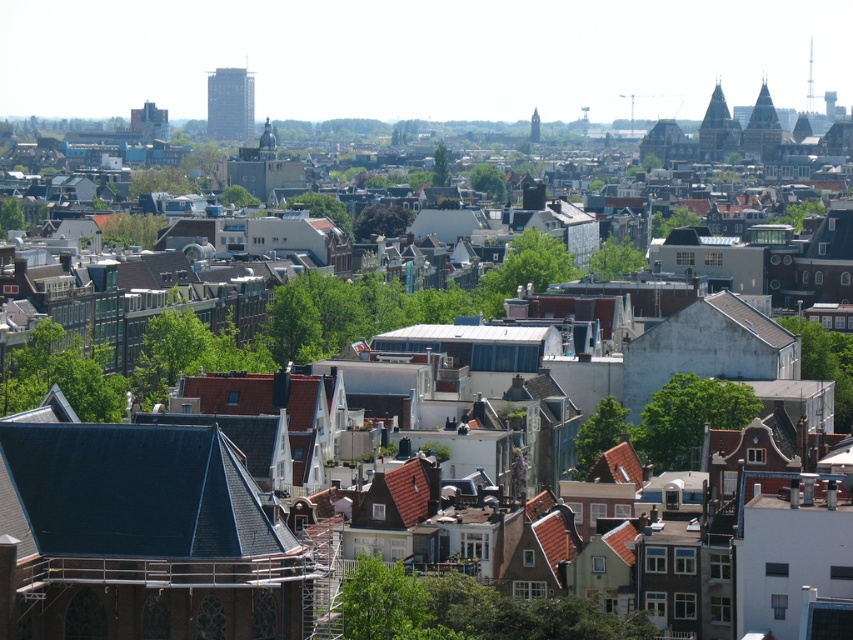
You are standing in the urban area shown in the image and want to walk from the point at coordinates point (252,100) to the point at coordinates point (712,109). Which direction should you move to get closer to your destination?

You should move away from the viewer because point (252,100) is closer to the viewer than point (712,109). Moving away from the viewer will take you towards the point at (712,109).

You are an architect designing a new building in this city. You want to ensure your design complements the existing structures. Considering the brown stone tower at upper right and the smooth silver spire at upper center, which of these two structures has a wider base to inform your building proportions?

The brown stone tower at upper right has a wider base than the smooth silver spire at upper center, so you should consider this width when designing your new building to maintain proportional harmony with the existing architecture.